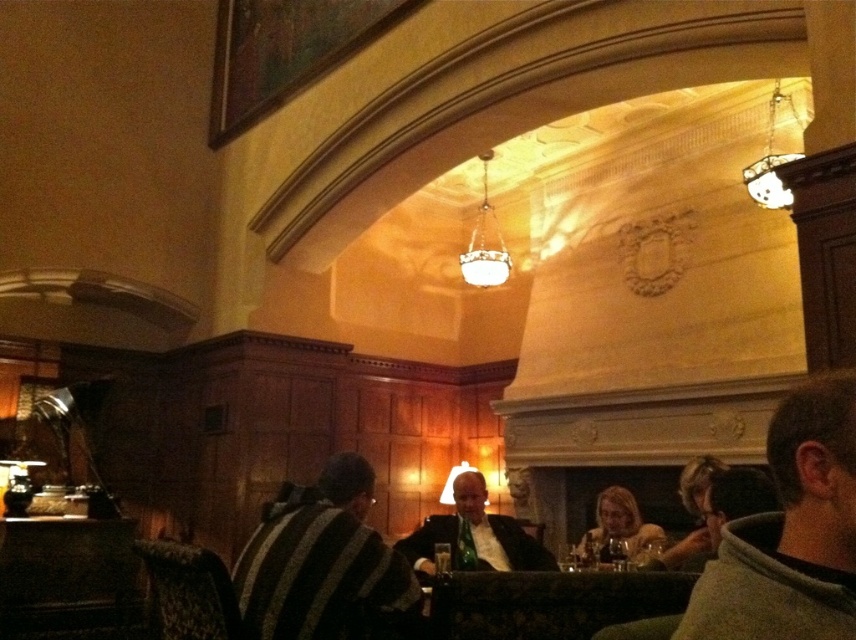
Is point (490, 593) in front of point (554, 566)?

Yes, point (490, 593) is closer to viewer.

In the scene shown: Does wooden table at center have a lesser width compared to matte black suit at center?

Yes.

Between point (522, 592) and point (513, 556), which one is positioned behind?

The point (513, 556) is more distant.

Locate an element on the screen. Image resolution: width=856 pixels, height=640 pixels. wooden table at center is located at coordinates (550, 602).

Is wooden table at center below white glass chandelier at center?

Yes, wooden table at center is below white glass chandelier at center.

Is point (610, 579) positioned before point (471, 262)?

Yes, point (610, 579) is closer to viewer.

Who is more forward, (x=615, y=572) or (x=495, y=256)?

Point (x=615, y=572) is more forward.

I want to click on wooden table at center, so click(550, 602).

Does light brown leather jacket at center appear under white glass chandelier at center?

Yes, light brown leather jacket at center is below white glass chandelier at center.

Who is higher up, light brown leather jacket at center or white glass chandelier at center?

white glass chandelier at center

In order to click on light brown leather jacket at center in this screenshot , I will do `click(620, 525)`.

This screenshot has width=856, height=640. What are the coordinates of `light brown leather jacket at center` in the screenshot? It's located at (620, 525).